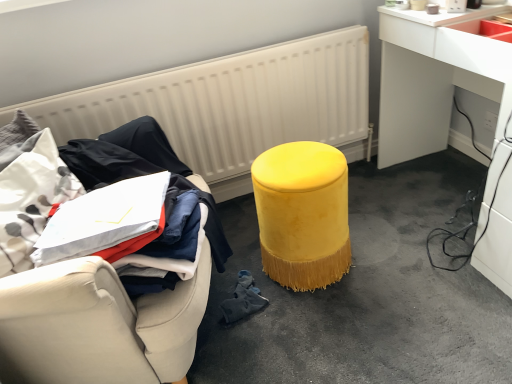
Question: Is black fabric at left inside or outside of white textured radiator at upper center?

Choices:
 (A) inside
 (B) outside

Answer: (B)

Question: Considering the positions of black fabric at left and white textured radiator at upper center in the image, is black fabric at left wider or thinner than white textured radiator at upper center?

Choices:
 (A) wide
 (B) thin

Answer: (A)

Question: Which object is positioned farthest from the velvet yellow stool at center?

Choices:
 (A) white textured radiator at upper center
 (B) white glossy desk at right
 (C) black fabric at left
 (D) velvet yellow stool at center
 (E) velvet yellow stool at center

Answer: (C)

Question: Estimate the real-world distances between objects in this image. Which object is closer to the white glossy desk at right?

Choices:
 (A) velvet yellow stool at center
 (B) white textured radiator at upper center
 (C) velvet yellow stool at center
 (D) black fabric at left
 (E) velvet yellow stool at center

Answer: (E)